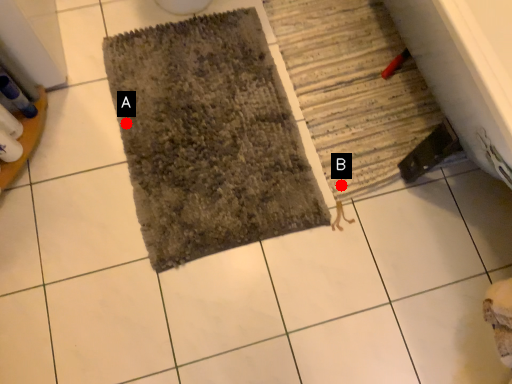
Question: Two points are circled on the image, labeled by A and B beside each circle. Which point is closer to the camera?

Choices:
 (A) A is closer
 (B) B is closer

Answer: (B)